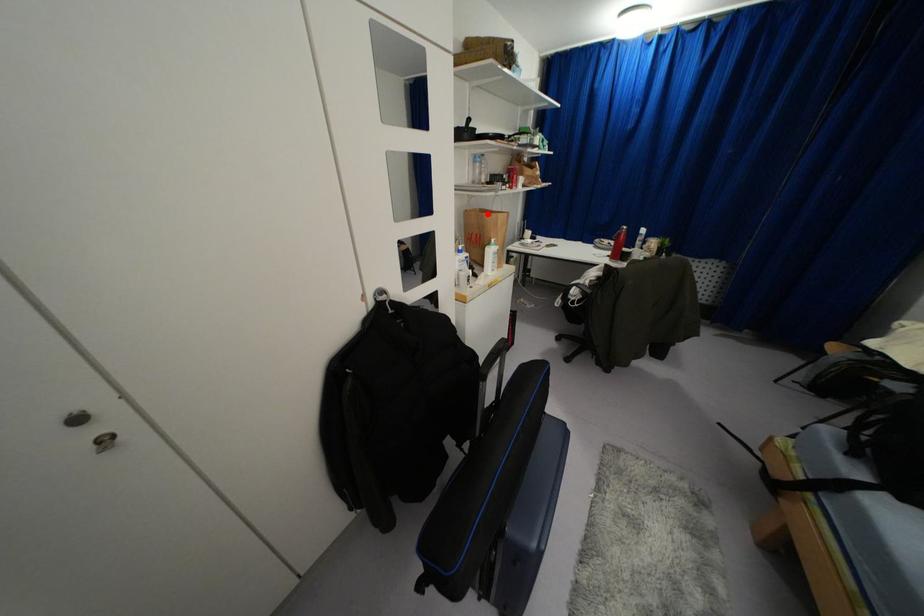
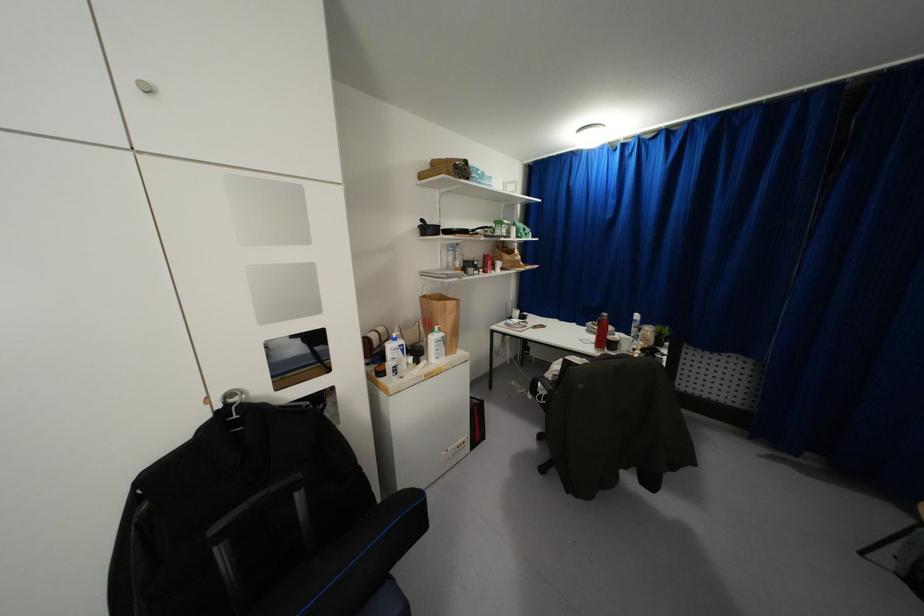
In the second image, find the point that corresponds to the highlighted location in the first image.

(434, 302)